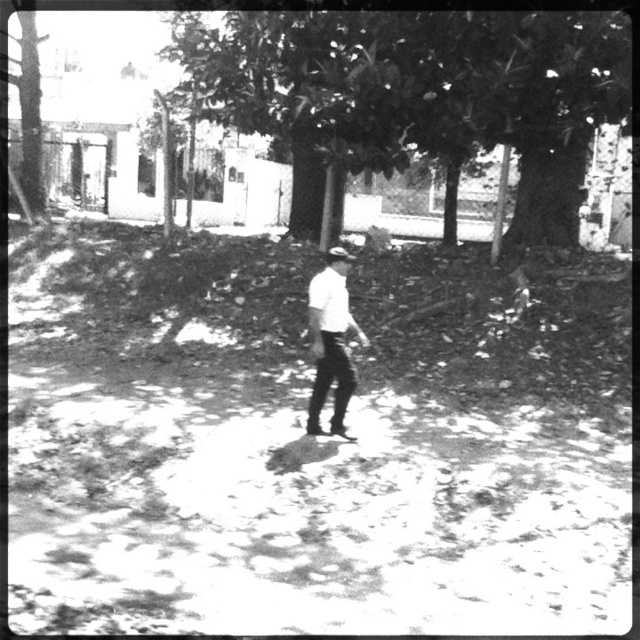
You are a photographer trying to capture the smooth bark tree at center and the white matte shirt at center in the same frame. Based on their positions, which object would appear closer to the camera in the photo?

The smooth bark tree at center is located above the white matte shirt at center, so in the photo, the white matte shirt at center would appear closer to the camera since it is positioned lower in the frame.

You are a photographer trying to capture both the smooth bark tree at center and the white matte shirt at center in a single frame. Based on their sizes, which object would appear smaller in the photo?

The smooth bark tree at center would appear smaller in the photo because its width is less than that of the white matte shirt at center.

You are a photographer analyzing the composition of this black and white photo. You notice the smooth bark tree at center and the white matte shirt at center. Which object takes up more visual space in the image?

The white matte shirt at center takes up more visual space than the smooth bark tree at center, as the smooth bark tree at center occupies less space than the white matte shirt at center.